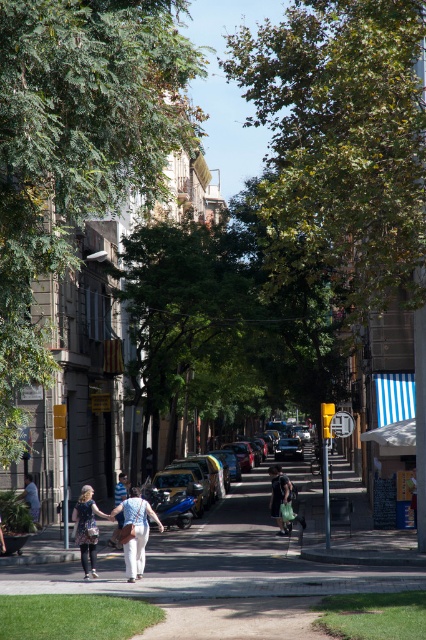
Which is more to the left, light blue shirt at center or light blue denim jacket at lower left?

Positioned to the left is light blue denim jacket at lower left.

Can you confirm if light blue shirt at center is smaller than light blue denim jacket at lower left?

Actually, light blue shirt at center might be larger than light blue denim jacket at lower left.

Between point (118, 513) and point (28, 492), which one is positioned in front?

Point (118, 513)

The height and width of the screenshot is (640, 426). Identify the location of light blue shirt at center. (120, 488).

Who is positioned more to the right, smooth concrete sidewalk at center or light blue shirt at center?

From the viewer's perspective, smooth concrete sidewalk at center appears more on the right side.

Which is behind, point (281, 538) or point (124, 481)?

The point (124, 481) is behind.

Find the location of a particular element. This screenshot has width=426, height=640. smooth concrete sidewalk at center is located at coordinates click(x=221, y=573).

Can you confirm if light blue denim pants at center is positioned above light blue shirt at center?

Correct, light blue denim pants at center is located above light blue shirt at center.

Who is positioned more to the right, light blue denim pants at center or light blue shirt at center?

light blue denim pants at center

Does point (134, 579) come behind point (120, 483)?

No, (134, 579) is closer to viewer.

Locate an element on the screen. The image size is (426, 640). light blue denim pants at center is located at coordinates (135, 531).